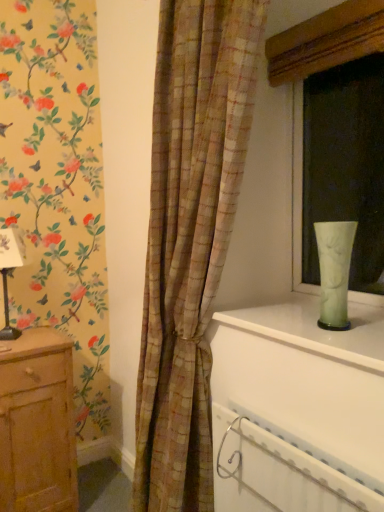
I want to click on spots to the right of matte black table lamp at left, so click(44, 338).